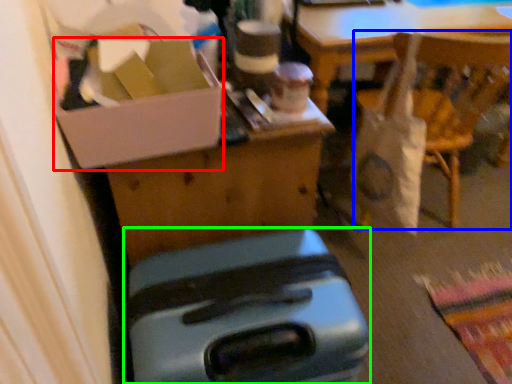
Question: Based on their relative distances, which object is nearer to box (highlighted by a red box)? Choose from chair (highlighted by a blue box) and luggage (highlighted by a green box).

Choices:
 (A) chair
 (B) luggage

Answer: (B)